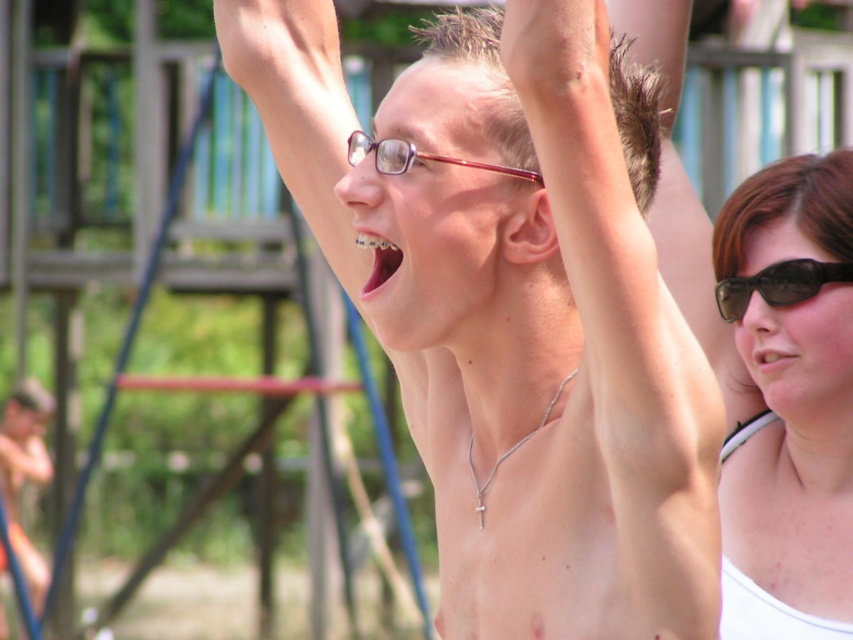
Is point (555, 592) closer to camera compared to point (373, 237)?

Yes, point (555, 592) is in front of point (373, 237).

Who is positioned more to the left, shiny skin at center or pink glossy teeth at center?

From the viewer's perspective, pink glossy teeth at center appears more on the left side.

Where is `shiny skin at center`? shiny skin at center is located at coordinates [x=515, y=310].

Locate an element on the screen. shiny skin at center is located at coordinates (515, 310).

Is the position of shiny skin at center less distant than that of skinny silver necklace at upper center?

No, shiny skin at center is behind skinny silver necklace at upper center.

Between shiny skin at center and skinny silver necklace at upper center, which one has more height?

With more height is shiny skin at center.

You are a GUI agent. You are given a task and a screenshot of the screen. Output one action in this format:
    pyautogui.click(x=<x>, y=<y>)
    Task: Click on the shiny skin at center
    The width and height of the screenshot is (853, 640).
    Given the screenshot: What is the action you would take?
    pyautogui.click(x=515, y=310)

In order to click on shiny skin at center in this screenshot , I will do coord(515,310).

Is black plastic sunglasses at upper right wider than clear plastic glasses at center?

Incorrect, black plastic sunglasses at upper right's width does not surpass clear plastic glasses at center's.

Measure the distance between point (741,316) and camera.

Point (741,316) is 4.67 meters away from camera.

Identify the location of black plastic sunglasses at upper right. The width and height of the screenshot is (853, 640). (778, 284).